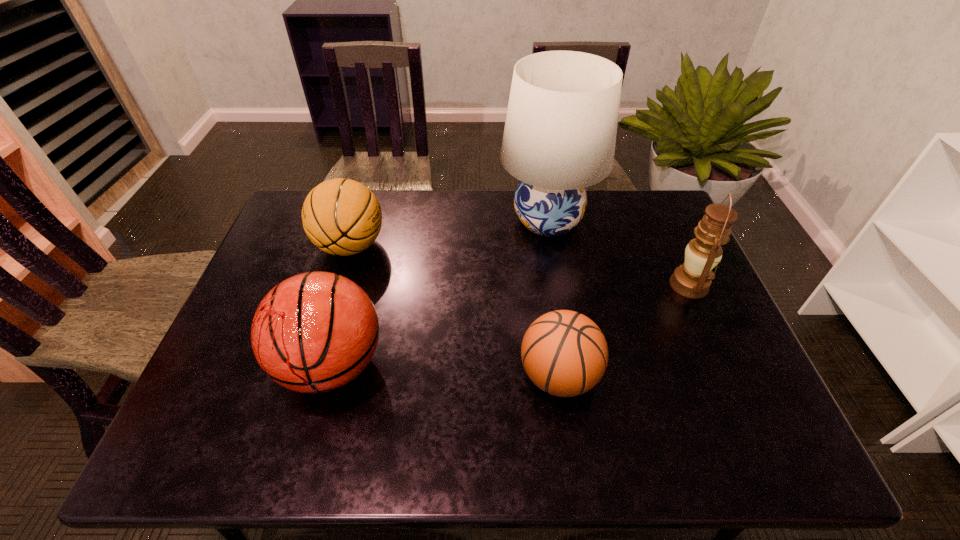
Where is `free spot between the tallest basketball and the lampshade`? free spot between the tallest basketball and the lampshade is located at coordinates (440, 293).

Identify the location of the third closest object to the tallest basketball. The width and height of the screenshot is (960, 540). (560, 132).

I want to click on object that is the second nearest to the tallest object, so click(564, 353).

Locate an element on the screen. This screenshot has width=960, height=540. basketball identified as the closest to the shortest basketball is located at coordinates (314, 332).

Identify which basketball is the second nearest to the oil lamp. Please provide its 2D coordinates. Your answer should be formatted as a tuple, i.e. [(x, y)], where the tuple contains the x and y coordinates of a point satisfying the conditions above.

[(314, 332)]

I want to click on free point that satisfies the following two spatial constraints: 1. on the back side of the oil lamp; 2. on the left side of the shortest object, so click(x=546, y=286).

Identify the location of free spot that satisfies the following two spatial constraints: 1. on the surface of the second tallest basketball near the brand logo; 2. on the back side of the shortest basketball. (312, 375).

Where is `vacant space that satisfies the following two spatial constraints: 1. on the surface of the farthest basketball near the brand logo; 2. on the right side of the rightmost basketball`? The width and height of the screenshot is (960, 540). vacant space that satisfies the following two spatial constraints: 1. on the surface of the farthest basketball near the brand logo; 2. on the right side of the rightmost basketball is located at coordinates (x=312, y=375).

Locate an element on the screen. This screenshot has width=960, height=540. vacant point that satisfies the following two spatial constraints: 1. on the side with spill of the tallest basketball; 2. on the right side of the shortest object is located at coordinates (329, 375).

Locate an element on the screen. The width and height of the screenshot is (960, 540). blank space that satisfies the following two spatial constraints: 1. on the surface of the farthest basketball near the brand logo; 2. on the back side of the oil lamp is located at coordinates (339, 286).